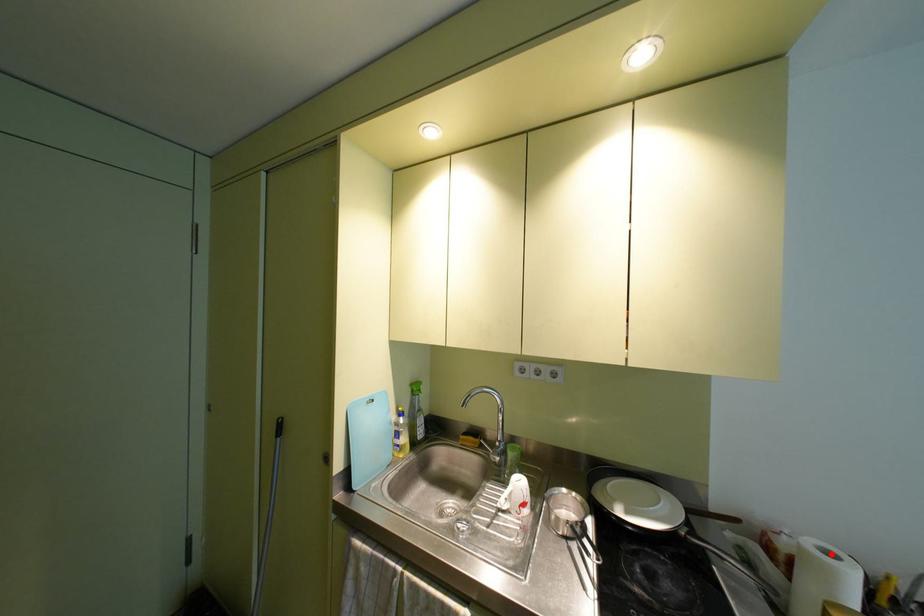
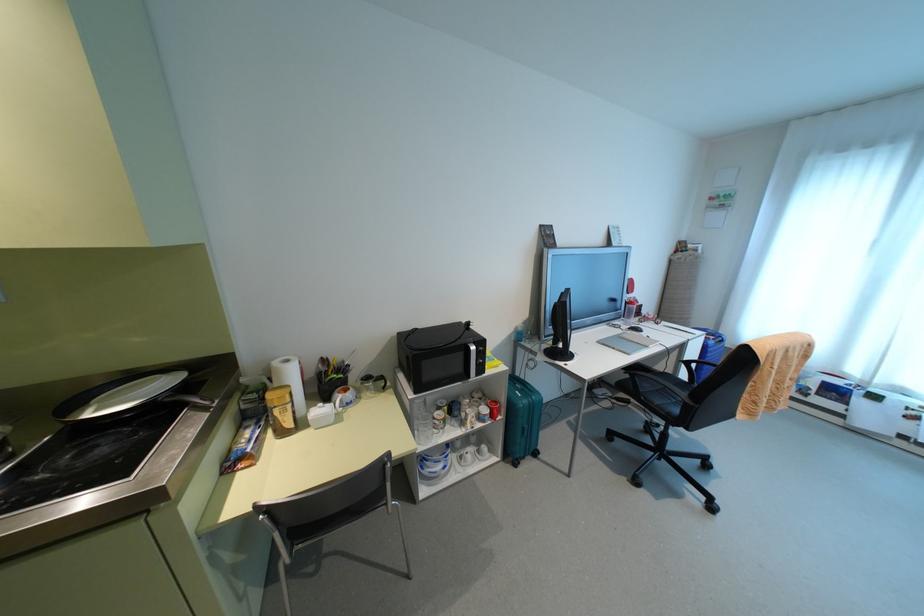
The point at the highlighted location is marked in the first image. Where is the corresponding point in the second image?

(286, 361)